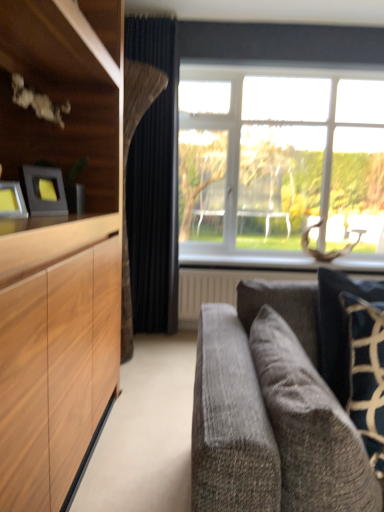
This screenshot has height=512, width=384. What are the coordinates of `vacant area on top of matte black picture frame at left, which is the second picture frame from front to back (from a real-world perspective)` in the screenshot? It's located at (37, 169).